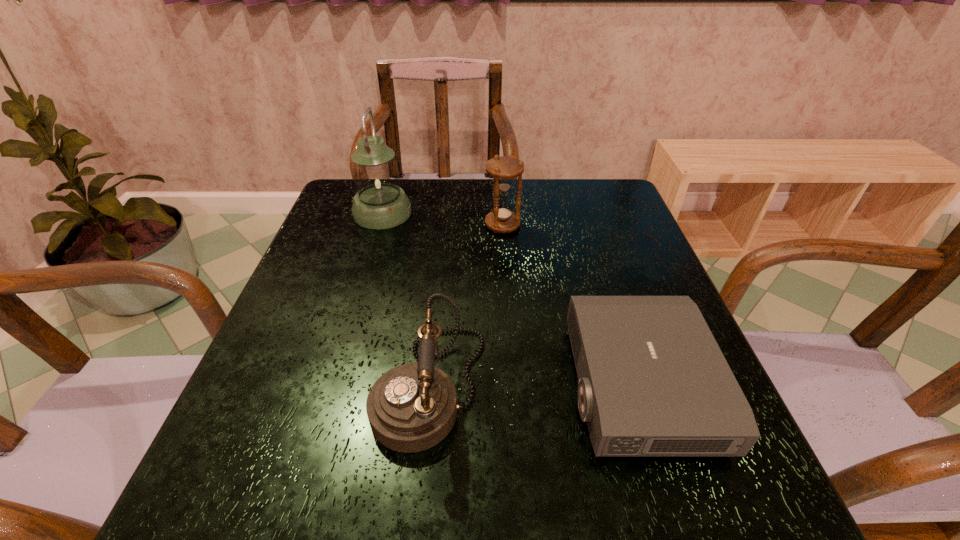
You are a GUI agent. You are given a task and a screenshot of the screen. Output one action in this format:
    pyautogui.click(x=<x>, y=<y>)
    Task: Click on the vacant space located 0.260m on the back of the second shortest object
    The width and height of the screenshot is (960, 540).
    Given the screenshot: What is the action you would take?
    pyautogui.click(x=444, y=249)

The image size is (960, 540). I want to click on vacant area located 0.310m on the front-facing side of the shortest object, so click(396, 385).

Where is `free space located on the front-facing side of the shortest object`? free space located on the front-facing side of the shortest object is located at coordinates (401, 385).

Locate an element on the screen. The image size is (960, 540). vacant space located 0.350m on the front-facing side of the shortest object is located at coordinates (372, 385).

At what (x,y) coordinates should I click in order to perform the action: click on lantern present at the far edge. Please return your answer as a coordinate pair (x, y). The width and height of the screenshot is (960, 540). Looking at the image, I should click on (380, 203).

Locate an element on the screen. The width and height of the screenshot is (960, 540). hourglass that is positioned at the far edge is located at coordinates (504, 169).

Find the location of `object present at the left edge`. object present at the left edge is located at coordinates (380, 203).

At what (x,y) coordinates should I click in order to perform the action: click on object present at the right edge. Please return your answer as a coordinate pair (x, y). The image size is (960, 540). Looking at the image, I should click on (653, 381).

Identify the location of object present at the far left corner. The height and width of the screenshot is (540, 960). (380, 203).

At what (x,y) coordinates should I click in order to perform the action: click on free space at the far edge of the desktop. Please return your answer as a coordinate pair (x, y). The width and height of the screenshot is (960, 540). Looking at the image, I should click on (507, 197).